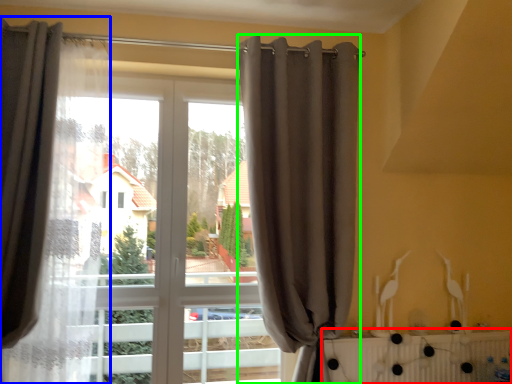
Question: Considering the real-world distances, which object is farthest from radiator (highlighted by a red box)? curtain (highlighted by a blue box) or curtain (highlighted by a green box)?

Choices:
 (A) curtain
 (B) curtain

Answer: (A)